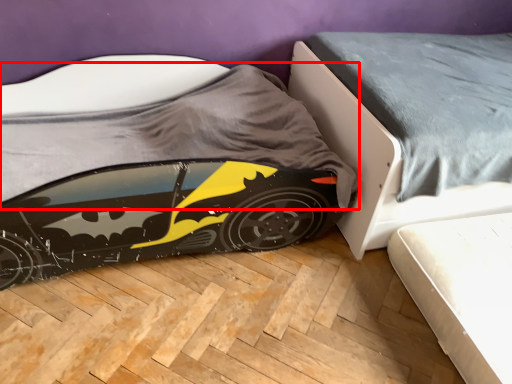
Question: Where is sheet (annotated by the red box) located in relation to bed in the image?

Choices:
 (A) right
 (B) left

Answer: (B)